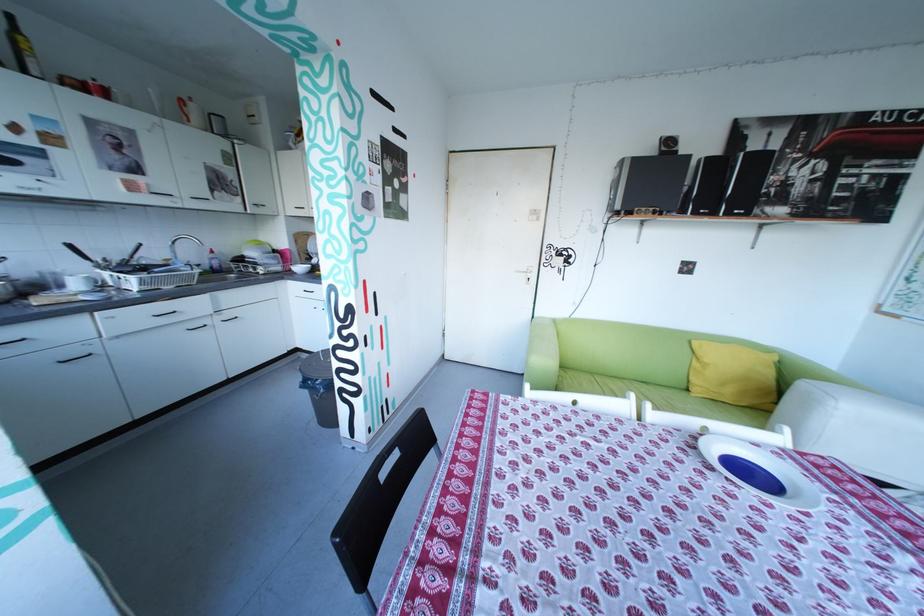
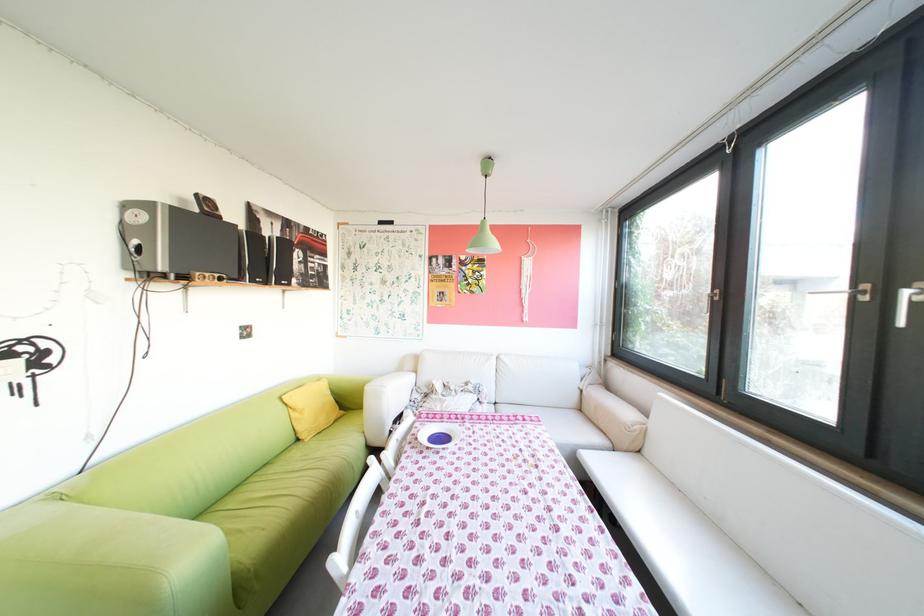
Where in the second image is the point corresponding to point (706, 394) from the first image?

(321, 440)